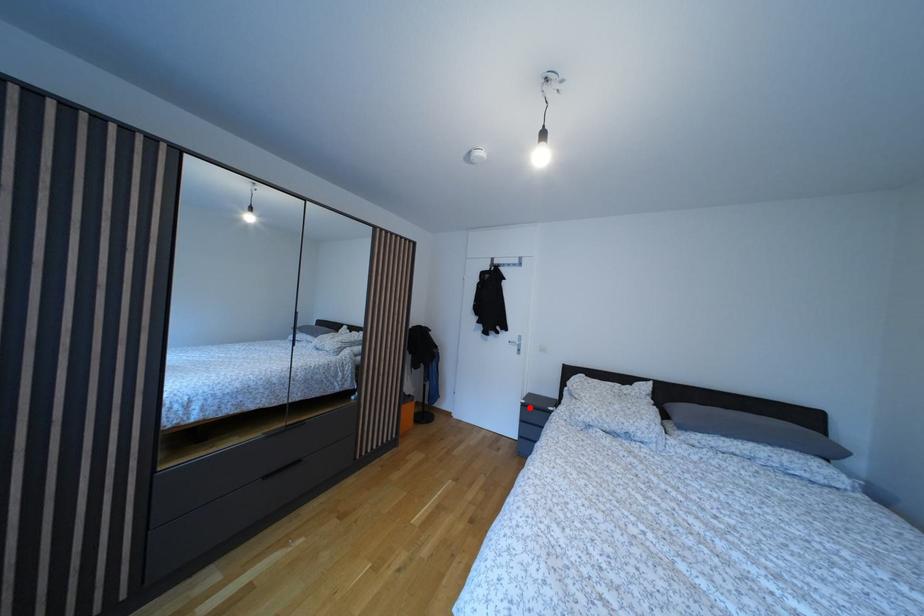
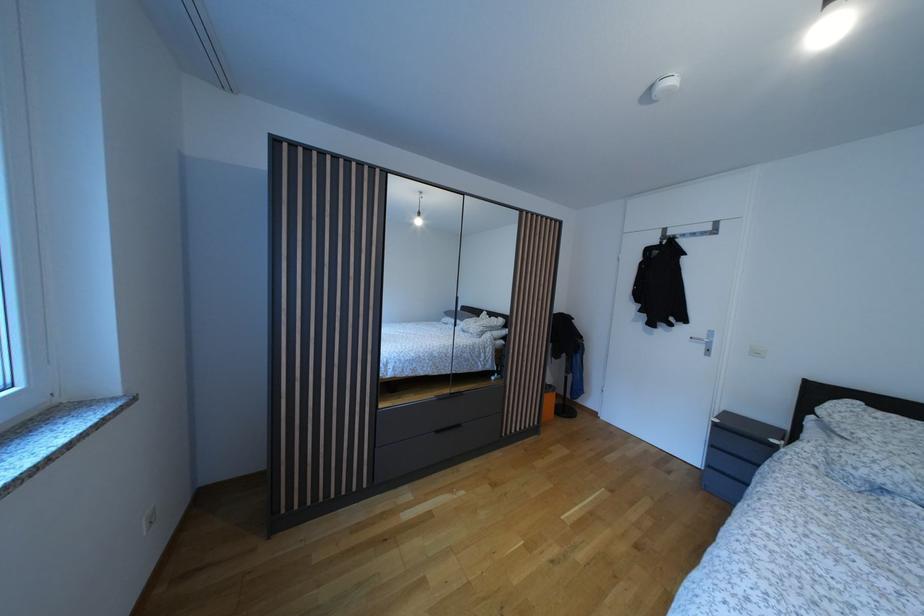
Where in the second image is the point corresponding to the highlighted location from the first image?

(723, 427)